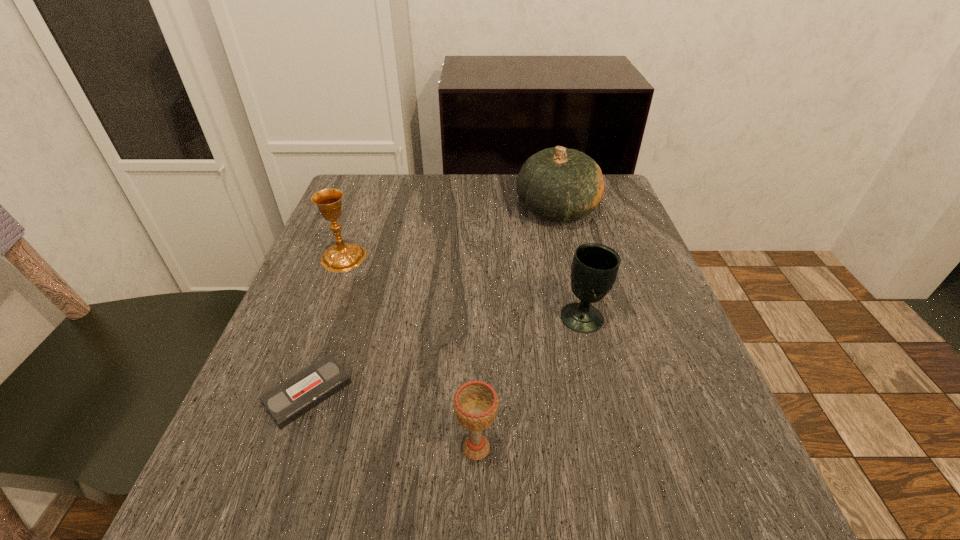
Identify the location of vacant space at the near edge. (507, 510).

Where is `free region at the left edge`? free region at the left edge is located at coordinates (386, 252).

Image resolution: width=960 pixels, height=540 pixels. Identify the location of free space at the right edge of the desktop. (670, 415).

Identify the location of vacant space at the far left corner of the desktop. (369, 203).

In the image, there is a desktop. Identify the location of free space at the far right corner. The width and height of the screenshot is (960, 540). (616, 207).

In the image, there is a desktop. Where is `vacant area at the near right corner`? The width and height of the screenshot is (960, 540). vacant area at the near right corner is located at coordinates (724, 486).

Locate an element on the screen. empty space between the second farthest object and the second nearest chalice is located at coordinates (463, 288).

Where is `free point between the farthest object and the rightmost chalice`? The width and height of the screenshot is (960, 540). free point between the farthest object and the rightmost chalice is located at coordinates (569, 264).

Locate an element on the screen. The image size is (960, 540). vacant region between the third nearest object and the farthest chalice is located at coordinates (463, 288).

Where is `vacant area that lies between the leftmost chalice and the shortest object`? vacant area that lies between the leftmost chalice and the shortest object is located at coordinates (325, 325).